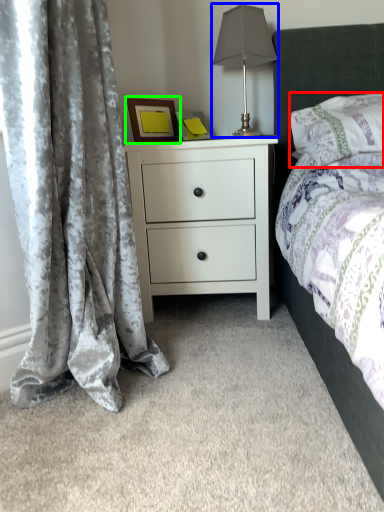
Question: Which is nearer to the pillow (highlighted by a red box)? table lamp (highlighted by a blue box) or picture frame (highlighted by a green box).

Choices:
 (A) table lamp
 (B) picture frame

Answer: (A)